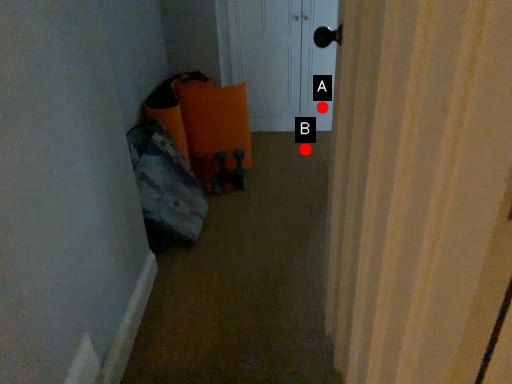
Question: Two points are circled on the image, labeled by A and B beside each circle. Which point is closer to the camera?

Choices:
 (A) A is closer
 (B) B is closer

Answer: (B)